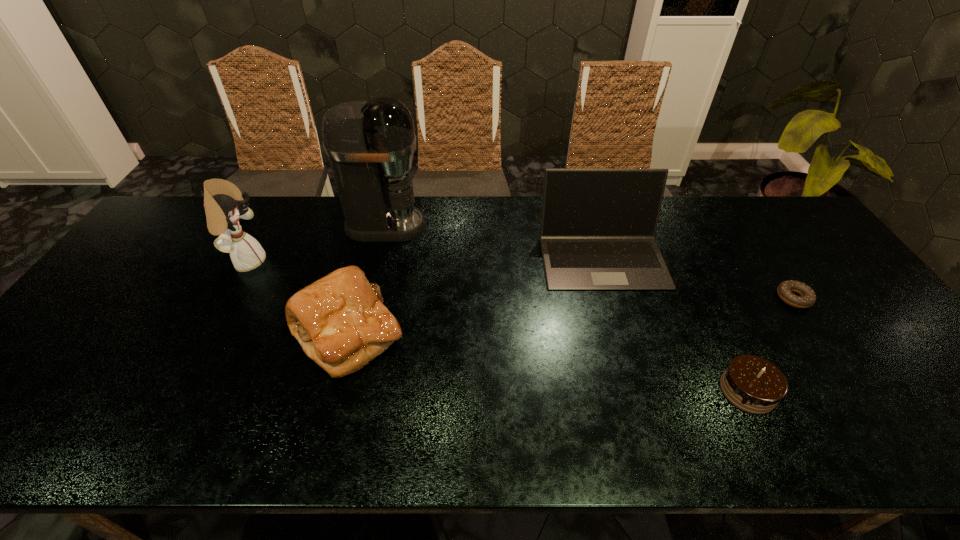
This screenshot has height=540, width=960. I want to click on vacant space located 0.290m place cup under the spout of the coffee maker, so click(x=516, y=226).

The image size is (960, 540). In order to click on free space located at the front face of the fifth shortest object in this screenshot , I will do `click(344, 262)`.

The width and height of the screenshot is (960, 540). In order to click on vacant area located 0.080m on the screen of the fourth shortest object in this screenshot , I will do `click(618, 312)`.

The image size is (960, 540). I want to click on vacant point located 0.330m on the filling side of the third shortest object, so click(536, 334).

The image size is (960, 540). Identify the location of vacant space located on the back of the fifth object from left to right. (712, 317).

I want to click on free region located on the left of the doughnut, so click(697, 298).

Locate an element on the screen. This screenshot has height=540, width=960. coffee maker that is at the far edge is located at coordinates (370, 144).

Image resolution: width=960 pixels, height=540 pixels. I want to click on doll that is at the far edge, so click(x=223, y=202).

The height and width of the screenshot is (540, 960). What are the coordinates of `laptop that is at the far edge` in the screenshot? It's located at click(598, 226).

This screenshot has height=540, width=960. I want to click on object located at the near edge, so click(753, 384).